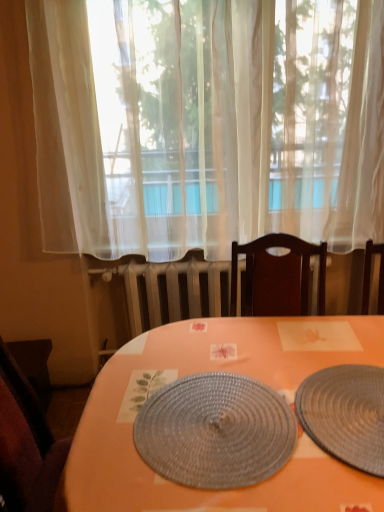
Question: In terms of size, does orange matte placemat at center appear bigger or smaller than dark brown wooden chair at lower left?

Choices:
 (A) small
 (B) big

Answer: (B)

Question: In terms of width, does orange matte placemat at center look wider or thinner when compared to dark brown wooden chair at lower left?

Choices:
 (A) wide
 (B) thin

Answer: (A)

Question: Which object is the closest to the dark brown wooden chair at lower left?

Choices:
 (A) woven gray placemat at center, which is counted as the 1th plate, starting from the left
 (B) rattan placemat at center, positioned as the first plate in right-to-left order
 (C) orange matte placemat at center
 (D) white sheer curtain at center

Answer: (C)

Question: Considering the real-world distances, which object is closest to the rattan placemat at center, acting as the second plate starting from the left?

Choices:
 (A) orange matte placemat at center
 (B) dark brown wooden chair at lower left
 (C) woven gray placemat at center, which is counted as the 1th plate, starting from the left
 (D) white sheer curtain at center

Answer: (C)